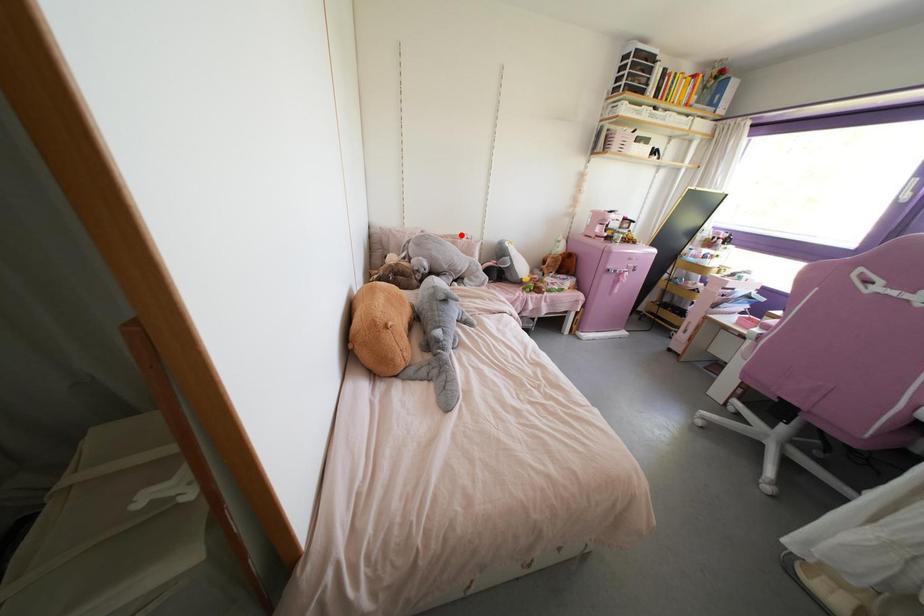
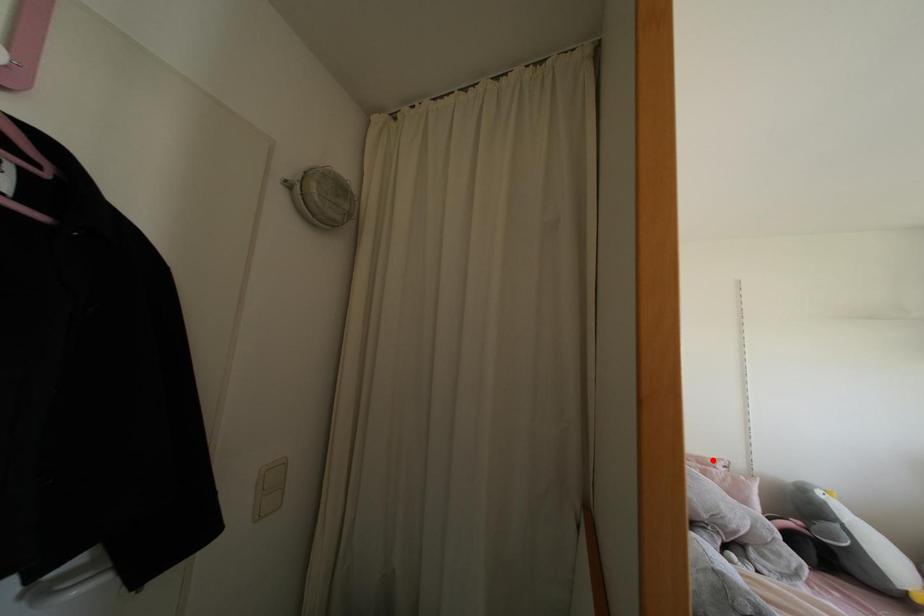
I am providing you with two images of the same scene from different viewpoints. A red point is marked on the first image and another point is marked on the second image. Does the point marked in image1 correspond to the same location as the one in image2?

Yes